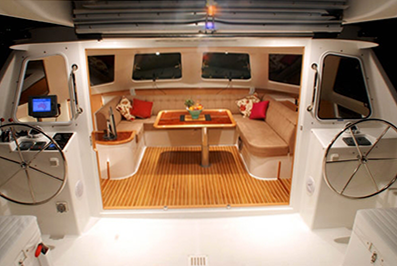
Where is `wood slat floor`? wood slat floor is located at coordinates (180, 186).